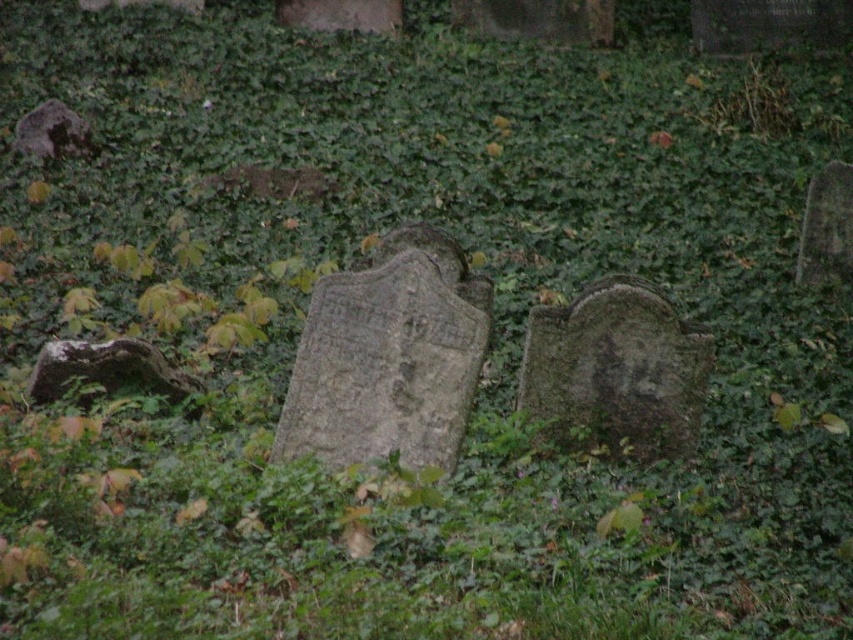
Can you confirm if green mossy gravestone at center is positioned to the right of rough gray stone at upper left?

Indeed, green mossy gravestone at center is positioned on the right side of rough gray stone at upper left.

What do you see at coordinates (618, 368) in the screenshot? I see `green mossy gravestone at center` at bounding box center [618, 368].

This screenshot has width=853, height=640. Find the location of `green mossy gravestone at center`. green mossy gravestone at center is located at coordinates [x=618, y=368].

Locate an element on the screen. The width and height of the screenshot is (853, 640). green mossy gravestone at center is located at coordinates (618, 368).

Between green mossy gravestone at center and rusty stone at left, which one has more height?

Standing taller between the two is green mossy gravestone at center.

Can you confirm if green mossy gravestone at center is positioned to the right of rusty stone at left?

Yes, green mossy gravestone at center is to the right of rusty stone at left.

Image resolution: width=853 pixels, height=640 pixels. What do you see at coordinates (618, 368) in the screenshot?
I see `green mossy gravestone at center` at bounding box center [618, 368].

Find the location of a particular element. The width and height of the screenshot is (853, 640). green mossy gravestone at center is located at coordinates (618, 368).

Is point (164, 362) more distant than point (74, 147)?

No.

Does rusty stone at left have a lesser height compared to rough gray stone at upper left?

Yes, rusty stone at left is shorter than rough gray stone at upper left.

Between point (102, 355) and point (47, 116), which one is positioned behind?

The point (47, 116) is more distant.

The height and width of the screenshot is (640, 853). In order to click on rusty stone at left in this screenshot , I will do `click(108, 369)`.